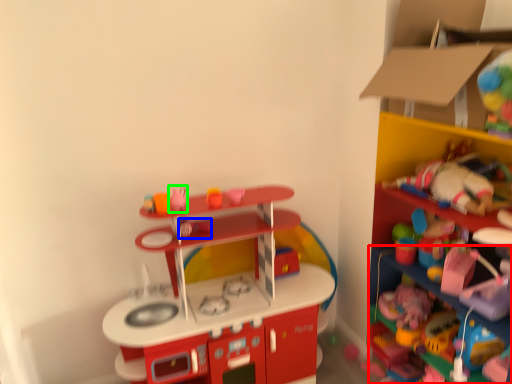
Question: Based on their relative distances, which object is farther from shelf (highlighted by a red box)? Choose from toy (highlighted by a blue box) and toy (highlighted by a green box).

Choices:
 (A) toy
 (B) toy

Answer: (B)